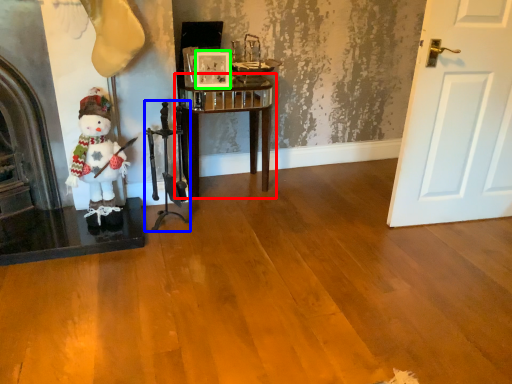
Question: Which is farther away from furniture (highlighted by a red box)? chair (highlighted by a blue box) or picture frame (highlighted by a green box)?

Choices:
 (A) chair
 (B) picture frame

Answer: (A)